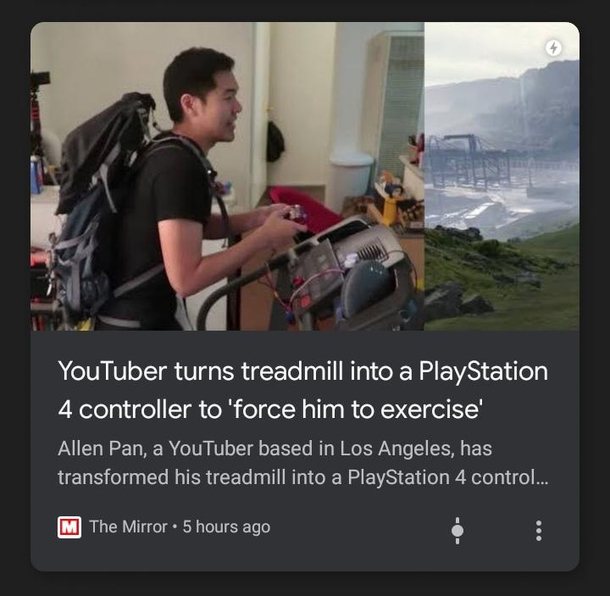
The width and height of the screenshot is (610, 596). Find the location of `wires`. wires is located at coordinates (287, 309).